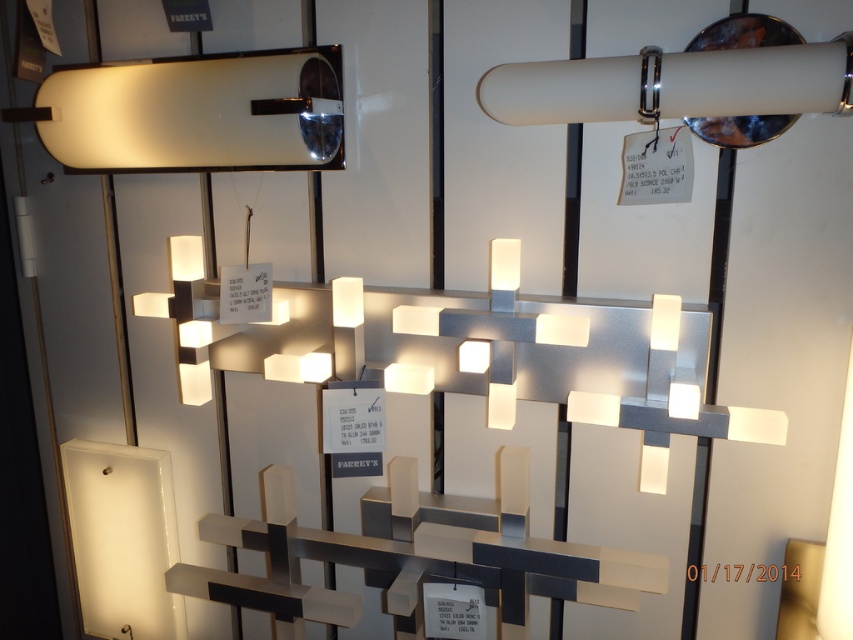
Does satin white glass at upper left appear on the left side of satin white tube at upper right?

Yes, satin white glass at upper left is to the left of satin white tube at upper right.

Is the position of satin white glass at upper left more distant than that of satin white tube at upper right?

Yes, satin white glass at upper left is behind satin white tube at upper right.

Describe the element at coordinates (196, 113) in the screenshot. I see `satin white glass at upper left` at that location.

Find the location of a particular element. The width and height of the screenshot is (853, 640). satin white glass at upper left is located at coordinates (196, 113).